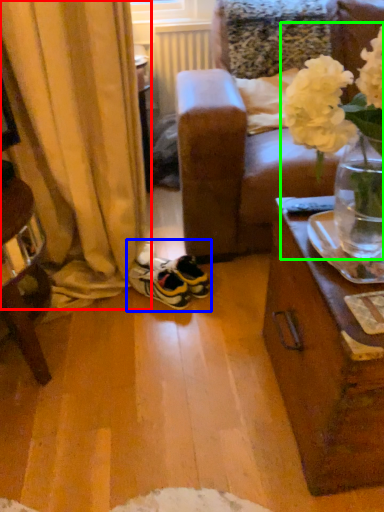
Question: Which is nearer to the curtain (highlighted by a red box)? footwear (highlighted by a blue box) or floral arrangement (highlighted by a green box).

Choices:
 (A) footwear
 (B) floral arrangement

Answer: (A)